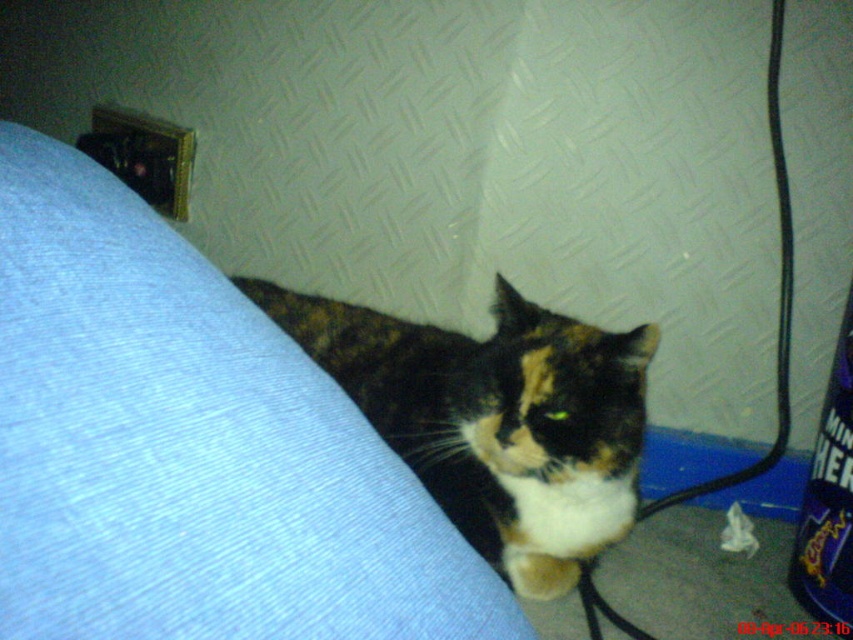
Between blue fabric couch at lower left and calico fur cat at center, which one appears on the right side from the viewer's perspective?

calico fur cat at center is more to the right.

Measure the distance from blue fabric couch at lower left to calico fur cat at center.

blue fabric couch at lower left and calico fur cat at center are 20.36 inches apart.

Image resolution: width=853 pixels, height=640 pixels. I want to click on blue fabric couch at lower left, so click(190, 449).